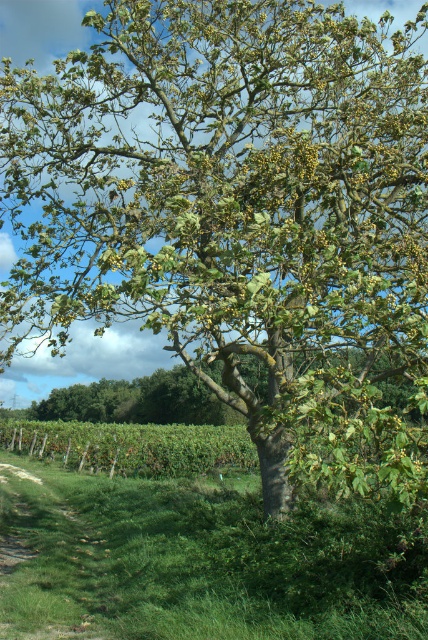
Question: Does grassy dirt path at lower left appear on the left side of green leafy tree at center?

Choices:
 (A) no
 (B) yes

Answer: (B)

Question: In this image, where is grassy dirt path at lower left located relative to green leafy tree at center?

Choices:
 (A) right
 (B) left

Answer: (B)

Question: Among these objects, which one is nearest to the camera?

Choices:
 (A) green leafy tree at center
 (B) grassy dirt path at lower left

Answer: (B)

Question: Can you confirm if grassy dirt path at lower left is positioned above green leafy tree at center?

Choices:
 (A) no
 (B) yes

Answer: (A)